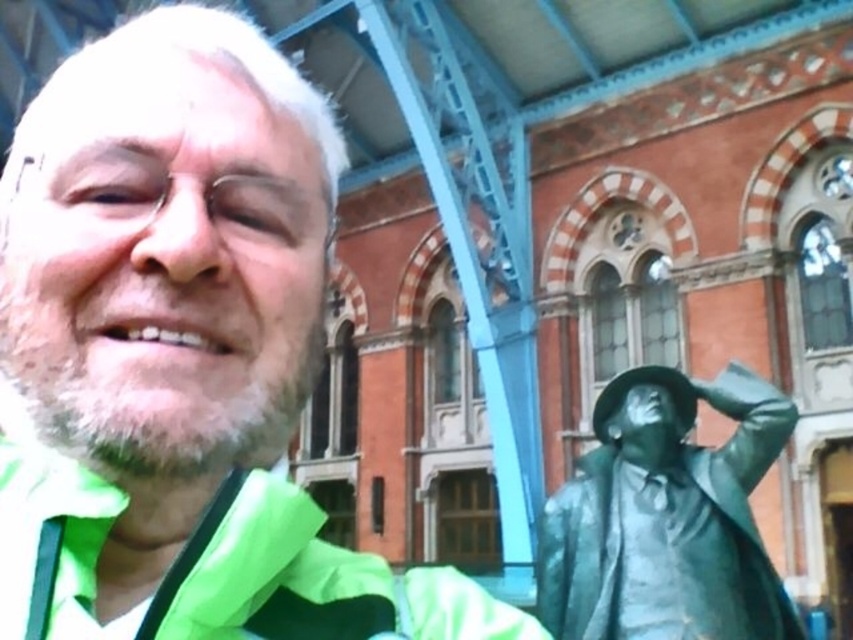
You are taking a photo of the historic building in the background. You notice two points in the image at coordinates point (117, 33) and point (755, 538). Which point is closer to the camera?

Point (117, 33) is closer to the camera than point (755, 538).

You are a photographer trying to capture both the green matte jacket at left and the bronze statue at right in the same frame. Based on their sizes, which object should you focus on first to ensure both fit in the photo?

The green matte jacket at left is taller than the bronze statue at right, so you should focus on framing the green matte jacket at left first to ensure both objects fit in the photo.